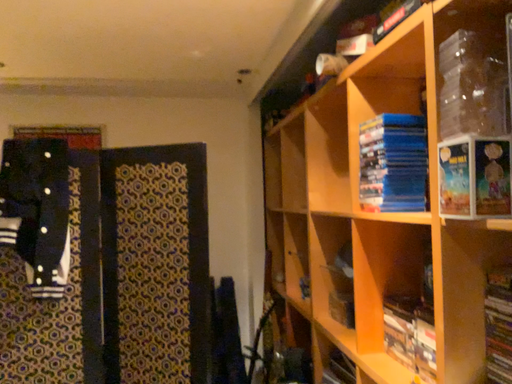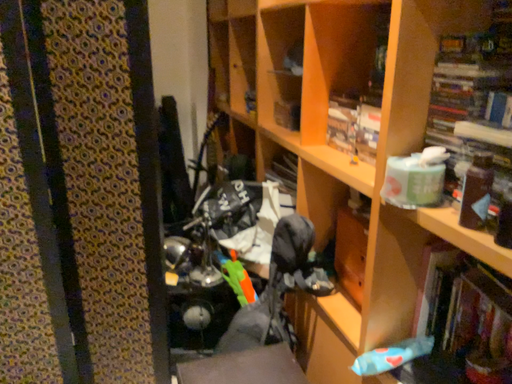
Question: Which way did the camera rotate in the video?

Choices:
 (A) rotated right
 (B) rotated left

Answer: (A)